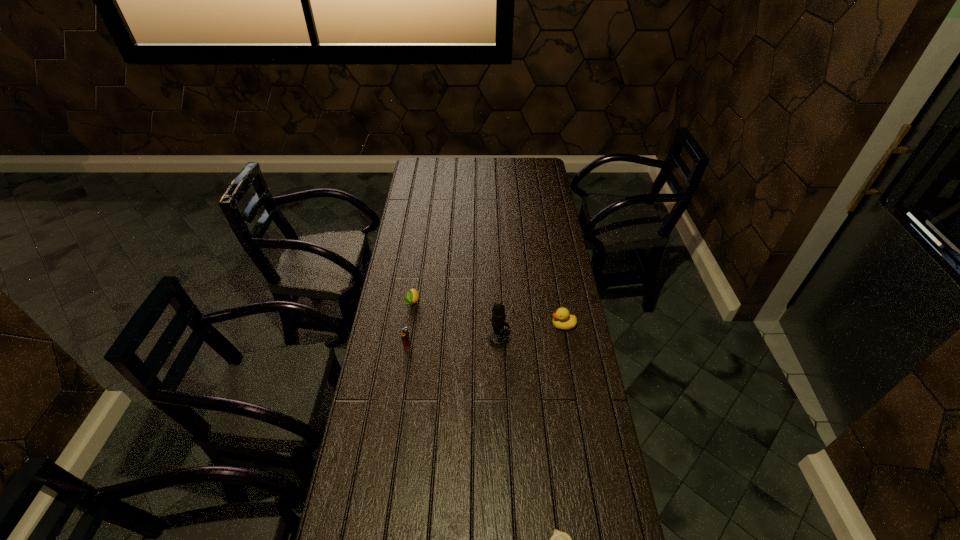
The image size is (960, 540). What are the coordinates of `free space between the third object from left to right and the farthest object` in the screenshot? It's located at [455, 321].

The image size is (960, 540). I want to click on free space between the duck and the igniter, so click(485, 336).

Where is `free space between the igniter and the rightmost object`? free space between the igniter and the rightmost object is located at coordinates (485, 336).

Find the location of a particular element. This screenshot has height=540, width=960. vacant space that's between the left lemon and the rightmost object is located at coordinates (488, 314).

I want to click on free space between the igniter and the duck, so click(x=485, y=336).

Locate an element on the screen. This screenshot has width=960, height=540. free spot between the igniter and the rightmost object is located at coordinates (485, 336).

This screenshot has width=960, height=540. Identify the location of object that is the closest to the right lemon. (498, 338).

Where is `object that is the fourth nearest to the third object from left to right`? The height and width of the screenshot is (540, 960). object that is the fourth nearest to the third object from left to right is located at coordinates (559, 539).

Find the location of a particular element. This screenshot has width=960, height=540. vacant point that satisfies the following two spatial constraints: 1. with leaves positioned above the farthest object; 2. on the right side of the igniter is located at coordinates (405, 346).